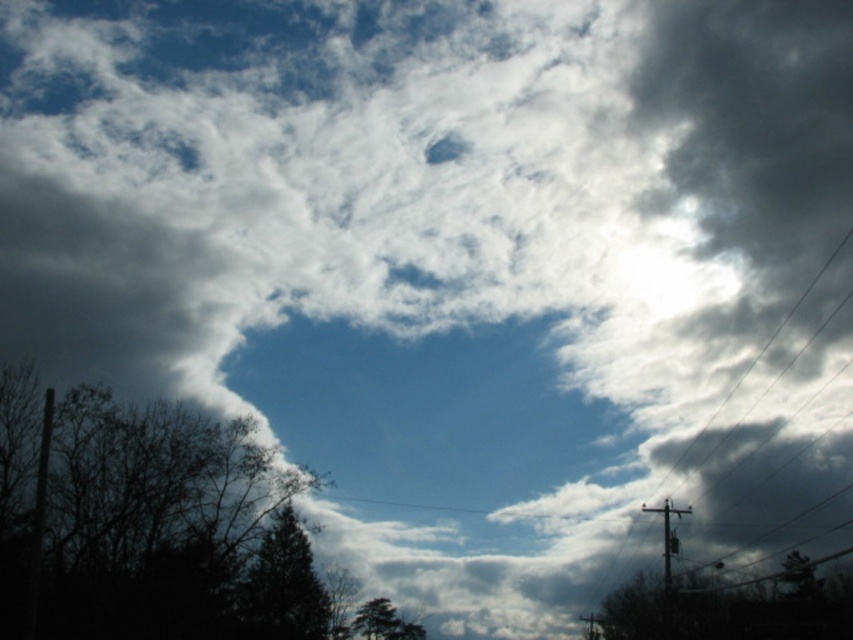
You are an observer standing in the middle of the image. You see the dark green leafy tree at lower left and the green leafy tree at lower right. Which tree is larger in size?

The dark green leafy tree at lower left is bigger than the green leafy tree at lower right.

You are a bird flying in the sky scene described. You see the dark green leafy tree at lower left and the green matte tree at lower center. Which tree would you need to fly over to reach the other one?

To reach the green matte tree at lower center from the dark green leafy tree at lower left, you would need to fly over the dark green leafy tree at lower left since it is located above the green matte tree at lower center.

You are a drone operator flying a drone that is 0.5 meters wide. You want to fly your drone from the left side of the image to the right side. Is there enough space between the green leafy tree at lower right and the nearest object to the right of it for your drone to pass through?

There is no object to the right of the green leafy tree at lower right, so the drone can safely fly to the right side of the image.